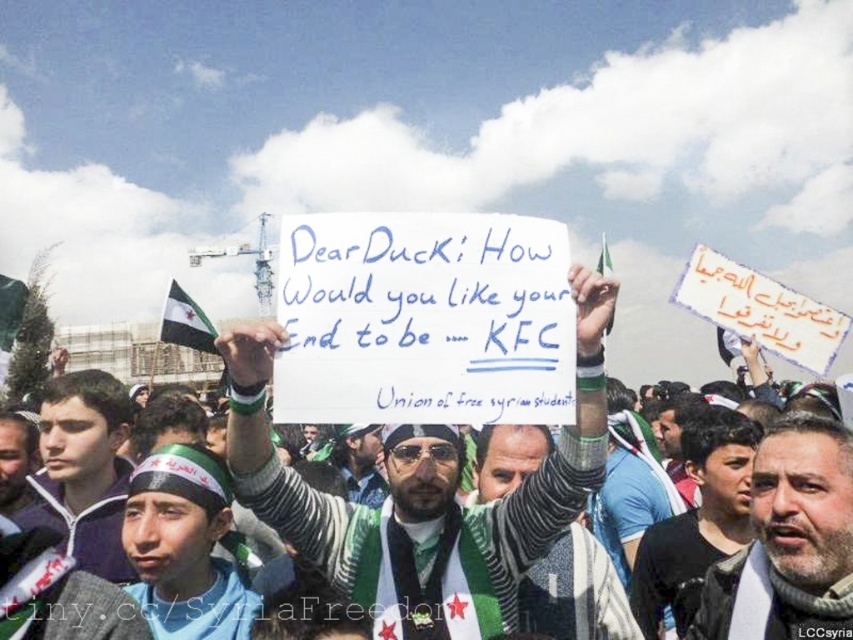
You are a photographer at the protest scene. You want to capture a photo where both the striped sweater at center and the gray beard at center are clearly visible. Given their heights, which object should you focus on to ensure both are in frame?

The striped sweater at center is taller than the gray beard at center, so focusing on the striped sweater at center would ensure both are in frame as the taller object would naturally include the shorter one within the same shot.

You are a photographer at the protest scene. You want to take a photo that includes both the striped sweater at center and the gray beard at center. Which object should you focus on first to ensure both are in frame?

The striped sweater at center is bigger than the gray beard at center, so you should focus on the striped sweater at center first to ensure both are in frame.